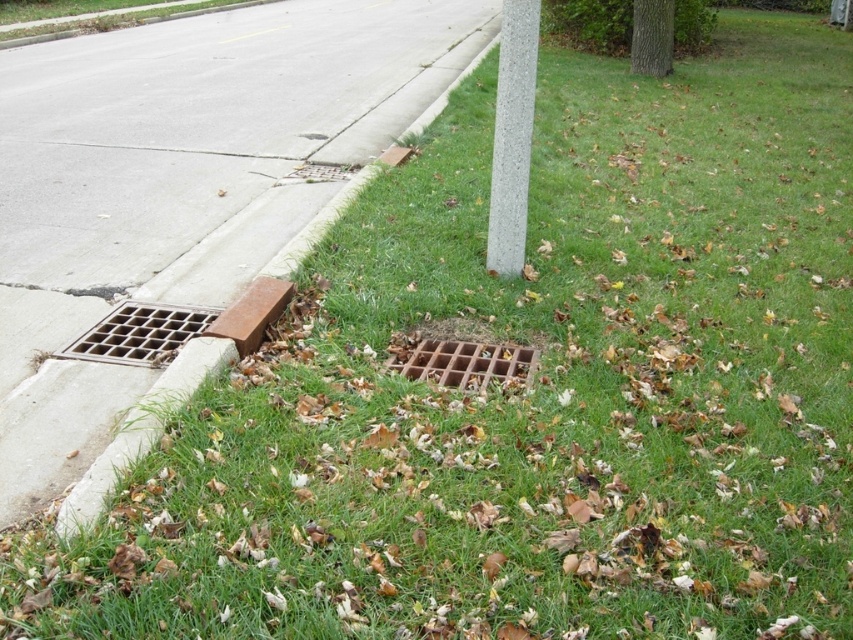
Question: Which object appears farthest from the camera in this image?

Choices:
 (A) gray concrete pole at upper center
 (B) brown metal grate at lower left
 (C) brown metal grate at center

Answer: (A)

Question: Is brown metal grate at lower center smaller than brown metal grate at lower left?

Choices:
 (A) yes
 (B) no

Answer: (B)

Question: Which point is closer to the camera?

Choices:
 (A) gray concrete pole at upper center
 (B) brown metal grate at center
 (C) brown metal grate at lower center

Answer: (C)

Question: Does brown metal grate at lower center appear on the left side of brown metal grate at center?

Choices:
 (A) yes
 (B) no

Answer: (A)

Question: Does brown metal grate at lower center appear on the left side of brown metal grate at lower left?

Choices:
 (A) yes
 (B) no

Answer: (A)

Question: Based on their relative distances, which object is farther from the brown metal grate at lower center?

Choices:
 (A) brown metal grate at center
 (B) brown metal grate at lower left
 (C) gray concrete pole at upper center

Answer: (C)